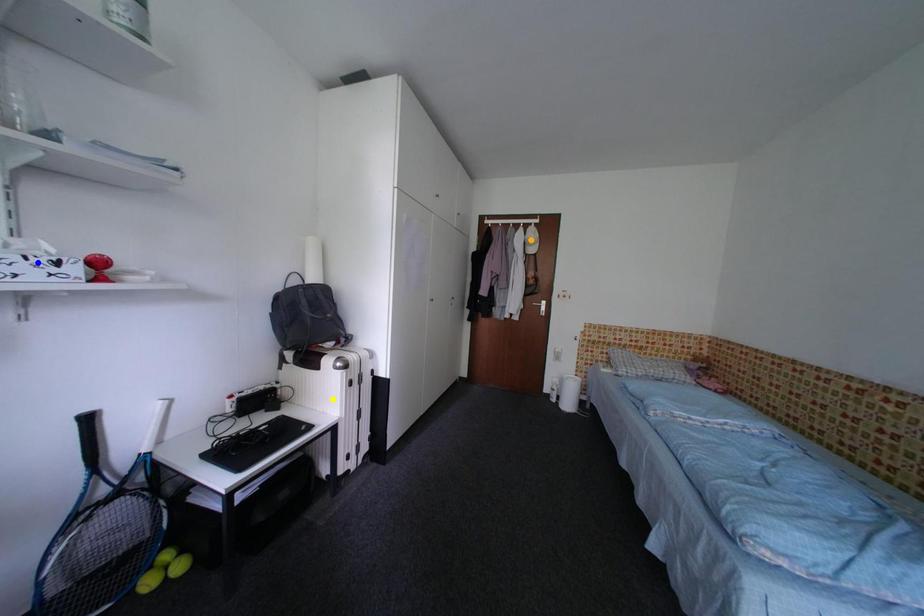
Order these from farthest to nearest:
A) blue point
B) orange point
C) yellow point

1. orange point
2. yellow point
3. blue point